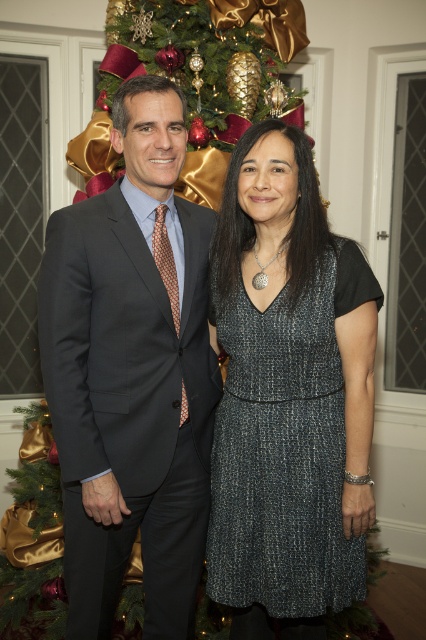
Question: Is dark gray suit at center positioned before sparkly metallic dress at center?

Choices:
 (A) no
 (B) yes

Answer: (B)

Question: Does dark gray suit at center have a larger size compared to sparkly metallic dress at center?

Choices:
 (A) yes
 (B) no

Answer: (A)

Question: Which object is farther from the camera taking this photo?

Choices:
 (A) sparkly metallic dress at center
 (B) dark gray suit at center

Answer: (A)

Question: Is dark gray suit at center in front of sparkly metallic dress at center?

Choices:
 (A) yes
 (B) no

Answer: (A)